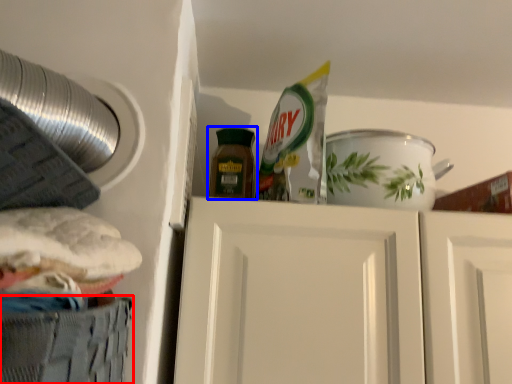
Question: Which object is closer to the camera taking this photo, cabinetry (highlighted by a red box) or bottle (highlighted by a blue box)?

Choices:
 (A) cabinetry
 (B) bottle

Answer: (A)